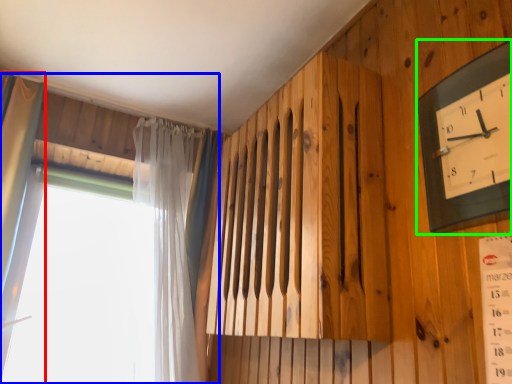
Question: Estimate the real-world distances between objects in this image. Which object is farther from curtain (highlighted by a red box), window (highlighted by a blue box) or wall clock (highlighted by a green box)?

Choices:
 (A) window
 (B) wall clock

Answer: (B)